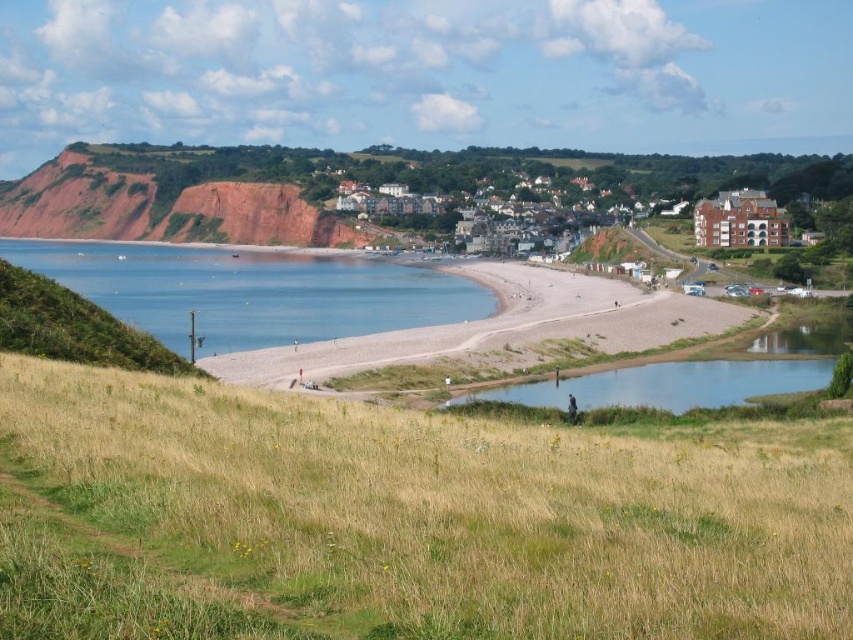
You are standing at the top of the grassy hill and want to walk to the smooth sand beach at center. Which direction should you go to avoid the green grassy field at lower left?

You should go away from the green grassy field at lower left towards the smooth sand beach at center since the green grassy field at lower left is shorter than the smooth sand beach at center, so it won

You are standing at the point with coordinates (399, 522) in the coastal scene. What do you see directly below you?

At point (399, 522) lies the green grassy field at lower left, so you would see the green grassy field at lower left directly below you.